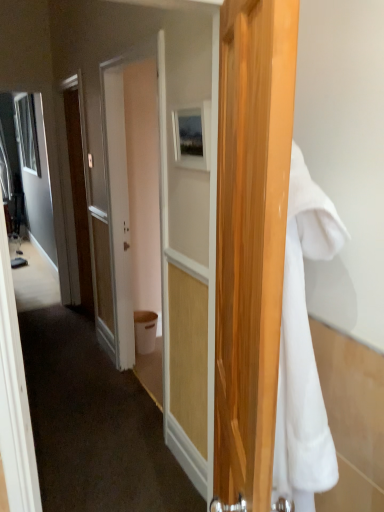
Question: From their relative heights in the image, would you say white fluffy towel at right is taller or shorter than matte white door at center?

Choices:
 (A) short
 (B) tall

Answer: (A)

Question: Based on their sizes in the image, would you say white fluffy towel at right is bigger or smaller than matte white door at center?

Choices:
 (A) big
 (B) small

Answer: (B)

Question: Which object is the farthest from the white plastic trash bin at center?

Choices:
 (A) white fluffy towel at right
 (B) matte wooden picture frame at center
 (C) matte white door at center

Answer: (A)

Question: Which is nearer to the white fluffy towel at right?

Choices:
 (A) matte wooden picture frame at center
 (B) matte white door at center
 (C) white plastic trash bin at center

Answer: (A)